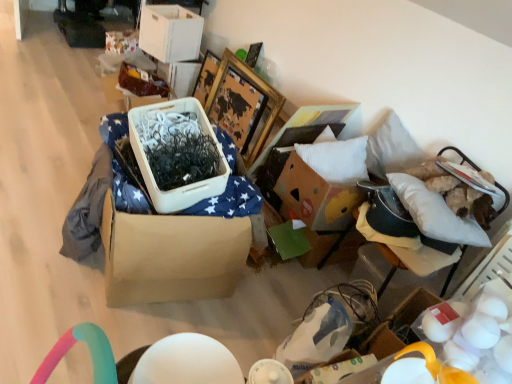
What do you see at coordinates (412, 258) in the screenshot? I see `white fabric cushion at right` at bounding box center [412, 258].

The width and height of the screenshot is (512, 384). Describe the element at coordinates (170, 33) in the screenshot. I see `white cardboard storage box at upper center, which ranks as the second storage box in bottom-to-top order` at that location.

What do you see at coordinates (243, 105) in the screenshot? I see `wooden picture frame at upper center` at bounding box center [243, 105].

The image size is (512, 384). I want to click on white fabric cushion at right, so click(412, 258).

Is white cardboard storage box at upper center, arranged as the 1th storage box when viewed from the top, wider than white matte eggs at lower right?

Yes, white cardboard storage box at upper center, arranged as the 1th storage box when viewed from the top, is wider than white matte eggs at lower right.

Considering the sizes of objects white cardboard storage box at upper center, which ranks as the second storage box in bottom-to-top order, and white matte eggs at lower right in the image provided, who is smaller, white cardboard storage box at upper center, which ranks as the second storage box in bottom-to-top order, or white matte eggs at lower right?

With smaller size is white matte eggs at lower right.

From a real-world perspective, who is located higher, white cardboard storage box at upper center, arranged as the 1th storage box when viewed from the top, or white matte eggs at lower right?

white matte eggs at lower right, from a real-world perspective.

In the scene shown: Is white soft pillow at upper right smaller than white fabric cushion at right?

Indeed, white soft pillow at upper right has a smaller size compared to white fabric cushion at right.

From a real-world perspective, between white soft pillow at upper right and white fabric cushion at right, who is vertically lower?

white fabric cushion at right is physically lower.

Find the location of a particular element. The image size is (512, 384). pillow located behind the white fabric cushion at right is located at coordinates (337, 159).

Could you tell me if white soft pillow at upper right is turned towards matte brown storage box at upper left, the 1th storage box positioned from the bottom?

No, white soft pillow at upper right is not facing towards matte brown storage box at upper left, the 1th storage box positioned from the bottom.

Is white soft pillow at upper right outside of matte brown storage box at upper left, the 1th storage box positioned from the bottom?

Yes, white soft pillow at upper right is not within matte brown storage box at upper left, the 1th storage box positioned from the bottom.

Between point (326, 175) and point (135, 99), which one is positioned behind?

Positioned behind is point (135, 99).

In the scene shown: From a real-world perspective, is white soft pillow at upper right physically above matte brown storage box at upper left, the 1th storage box positioned from the bottom?

Indeed, from a real-world perspective, white soft pillow at upper right stands above matte brown storage box at upper left, the 1th storage box positioned from the bottom.

Considering the relative sizes of brown cardboard box at center and white soft pillow at upper right in the image provided, is brown cardboard box at center smaller than white soft pillow at upper right?

Incorrect, brown cardboard box at center is not smaller in size than white soft pillow at upper right.

Are brown cardboard box at center and white soft pillow at upper right far apart?

No, brown cardboard box at center is not far away from white soft pillow at upper right.

Is point (120, 246) positioned behind point (327, 162)?

No, (120, 246) is closer to viewer.

Considering their positions, is brown cardboard box at center located in front of or behind white soft pillow at upper right?

In the image, brown cardboard box at center appears in front of white soft pillow at upper right.

Can you confirm if white soft pillow at upper right is bigger than brown cardboard box at center?

No.

From a real-world perspective, does white soft pillow at upper right sit lower than brown cardboard box at center?

Actually, white soft pillow at upper right is physically above brown cardboard box at center in the real world.

Based on the photo, is white soft pillow at upper right closer to camera compared to brown cardboard box at center?

No, it is behind brown cardboard box at center.

Looking at this image, does brown cardboard box at center have a smaller size compared to matte brown storage box at upper left, the 1th storage box positioned from the bottom?

No, brown cardboard box at center is not smaller than matte brown storage box at upper left, the 1th storage box positioned from the bottom.

From the image's perspective, is brown cardboard box at center located beneath matte brown storage box at upper left, acting as the 2th storage box starting from the top?

Yes, from the image's perspective, brown cardboard box at center is beneath matte brown storage box at upper left, acting as the 2th storage box starting from the top.

Which of these two, brown cardboard box at center or matte brown storage box at upper left, acting as the 2th storage box starting from the top, stands shorter?

matte brown storage box at upper left, acting as the 2th storage box starting from the top.

Is brown cardboard box at center to the left or to the right of matte brown storage box at upper left, the 1th storage box positioned from the bottom, in the image?

Clearly, brown cardboard box at center is on the right of matte brown storage box at upper left, the 1th storage box positioned from the bottom, in the image.

Could you measure the distance between wooden picture frame at upper center and matte brown storage box at upper left, acting as the 2th storage box starting from the top?

22.14 inches.

Which is more distant, (225,110) or (120,89)?

The point (225,110) is farther.

Considering their positions, is wooden picture frame at upper center located in front of or behind matte brown storage box at upper left, the 1th storage box positioned from the bottom?

wooden picture frame at upper center is positioned closer to the viewer than matte brown storage box at upper left, the 1th storage box positioned from the bottom.

Looking at this image, is wooden picture frame at upper center turned away from matte brown storage box at upper left, acting as the 2th storage box starting from the top?

wooden picture frame at upper center does not have its back to matte brown storage box at upper left, acting as the 2th storage box starting from the top.

At what (x,y) coordinates should I click in order to perform the action: click on egg lying below the white cardboard storage box at upper center, arranged as the 1th storage box when viewed from the top (from the image's perspective). Please return your answer as a coordinate pair (x, y). Looking at the image, I should click on (477, 334).

At what (x,y) coordinates should I click in order to perform the action: click on pillow above the white fabric cushion at right (from the image's perspective). Please return your answer as a coordinate pair (x, y). Looking at the image, I should click on (337, 159).

Estimate the real-world distances between objects in this image. Which object is closer to wooden picture frame at upper center, white matte eggs at lower right or white cardboard storage box at upper center, arranged as the 1th storage box when viewed from the top?

Based on the image, white cardboard storage box at upper center, arranged as the 1th storage box when viewed from the top, appears to be nearer to wooden picture frame at upper center.

Which object lies further to the anchor point white soft pillow at upper right, white cardboard storage box at upper center, arranged as the 1th storage box when viewed from the top, or wooden picture frame at upper center?

white cardboard storage box at upper center, arranged as the 1th storage box when viewed from the top, is further to white soft pillow at upper right.

When comparing their distances from wooden picture frame at upper center, does white fabric cushion at right or brown cardboard box at center seem further?

brown cardboard box at center is positioned further to the anchor wooden picture frame at upper center.

Based on the photo, from the image, which object appears to be nearer to white fabric cushion at right, white matte eggs at lower right or white soft pillow at upper right?

The object closer to white fabric cushion at right is white soft pillow at upper right.

Looking at the image, which one is located further to white fabric cushion at right, white cardboard storage box at upper center, which ranks as the second storage box in bottom-to-top order, or wooden picture frame at upper center?

white cardboard storage box at upper center, which ranks as the second storage box in bottom-to-top order, is further to white fabric cushion at right.

Based on their spatial positions, is white fabric cushion at right or white soft pillow at upper right closer to matte brown storage box at upper left, the 1th storage box positioned from the bottom?

Based on the image, white soft pillow at upper right appears to be nearer to matte brown storage box at upper left, the 1th storage box positioned from the bottom.

Considering their positions, is brown cardboard box at center positioned closer to wooden picture frame at upper center than white soft pillow at upper right?

The object closer to wooden picture frame at upper center is white soft pillow at upper right.

Based on the photo, estimate the real-world distances between objects in this image. Which object is closer to brown cardboard box at center, white fabric cushion at right or white soft pillow at upper right?

white soft pillow at upper right is positioned closer to the anchor brown cardboard box at center.

Where is `cardboard box between white matte eggs at lower right and wooden picture frame at upper center along the z-axis`? The width and height of the screenshot is (512, 384). cardboard box between white matte eggs at lower right and wooden picture frame at upper center along the z-axis is located at coordinates (170, 256).

You are a GUI agent. You are given a task and a screenshot of the screen. Output one action in this format:
    pyautogui.click(x=<x>, y=<y>)
    Task: Click on the cardboard box between white matte eggs at lower right and white cardboard storage box at upper center, arranged as the 1th storage box when viewed from the top, in the front-back direction
    This screenshot has width=512, height=384.
    Given the screenshot: What is the action you would take?
    [170, 256]

The width and height of the screenshot is (512, 384). In order to click on furniture located between white matte eggs at lower right and white cardboard storage box at upper center, which ranks as the second storage box in bottom-to-top order, in the depth direction in this screenshot , I will do pos(412,258).

The image size is (512, 384). What are the coordinates of `picture frame located between brown cardboard box at center and white fabric cushion at right in the left-right direction` in the screenshot? It's located at (243, 105).